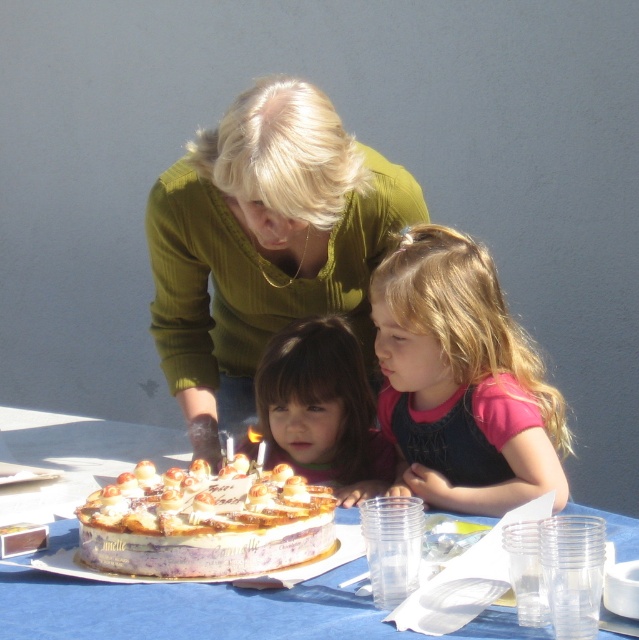
You are standing at the edge of the birthday table and see the point at coordinates (263, 243). What object is located at that point?

The point at coordinates (263, 243) is on the green ribbed sweater at center.

You are a photographer at the birthday celebration and want to ensure both the pink fabric shirt at center and the smooth brown hair at center are fully visible in your shot. Given that your camera has a fixed frame width, which object should you adjust your focus towards to accommodate the wider object?

The pink fabric shirt at center is wider than the smooth brown hair at center, so you should focus on the pink fabric shirt at center to ensure it fits within the camera frame.